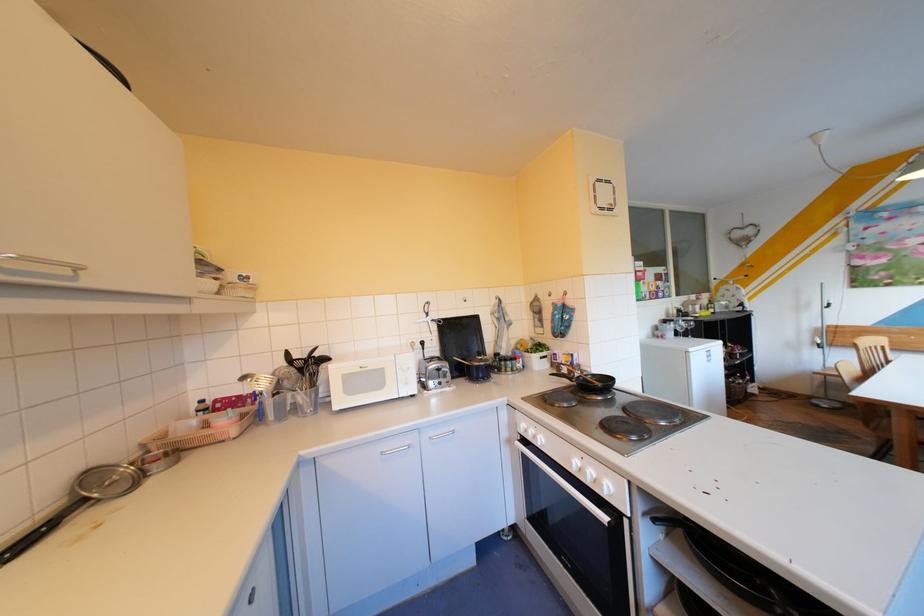
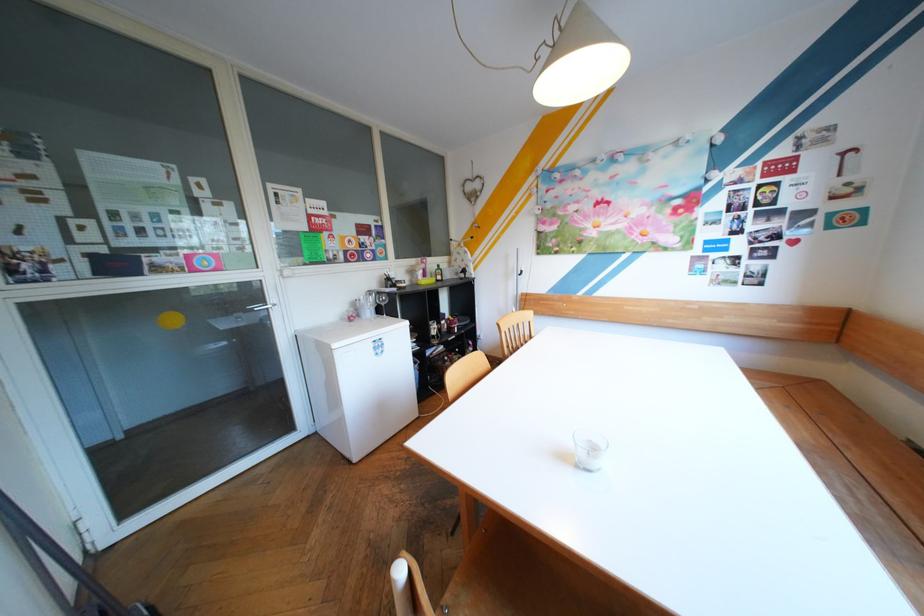
In the second image, find the point that corresponds to [697,297] in the first image.

(426, 261)